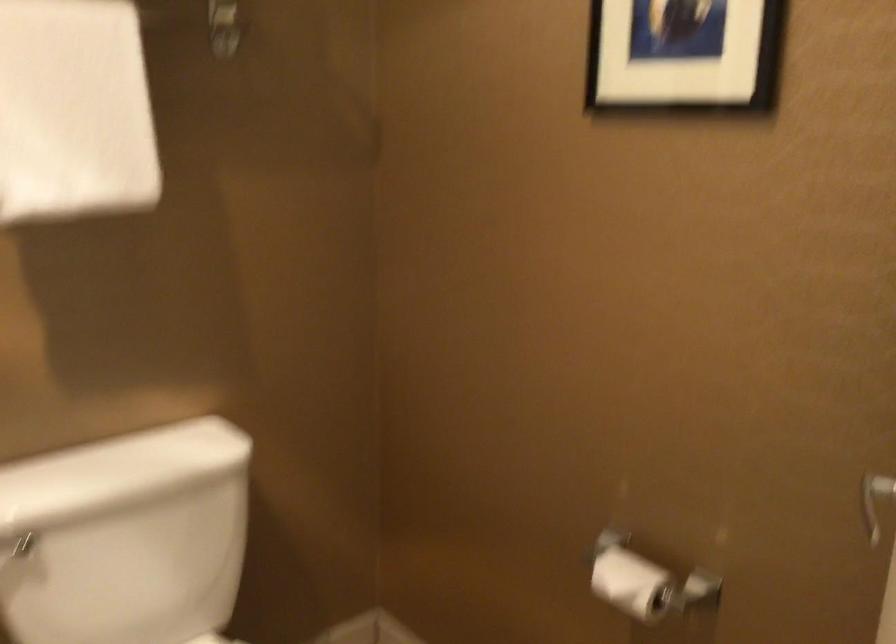
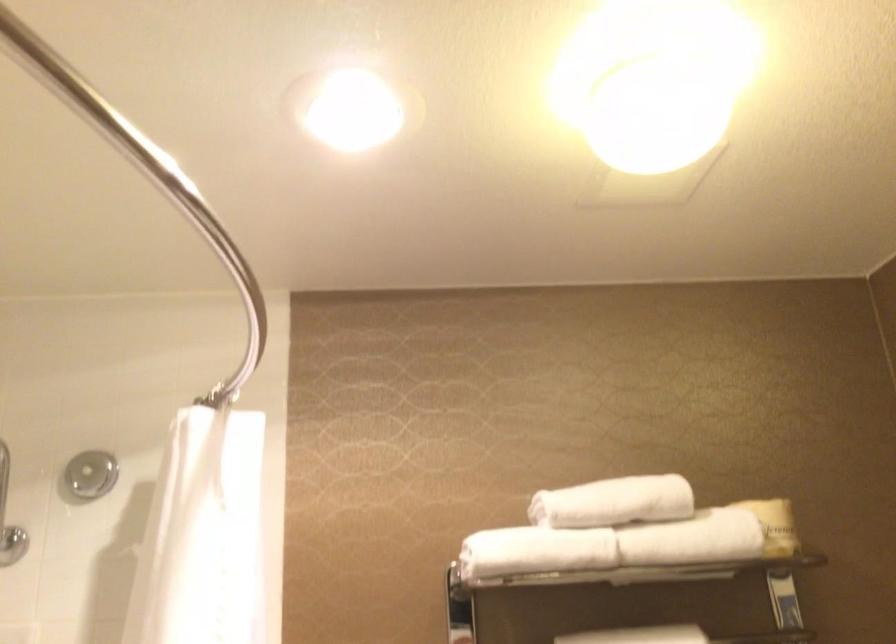
Based on the photo, the first image is from the beginning of the video and the second image is from the end. How did the camera likely rotate when shooting the video?

The camera's rotation is toward left-up.